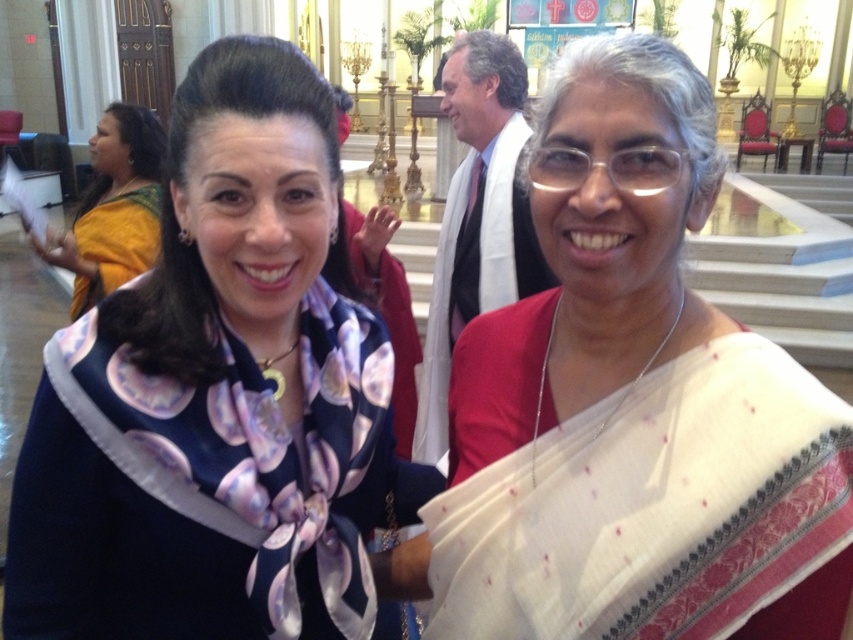
Question: Which object appears farthest from the camera in this image?

Choices:
 (A) silky floral scarf at center
 (B) white silk saree at center
 (C) yellow silk saree at left

Answer: (C)

Question: Which object is positioned farthest from the white silk saree at center?

Choices:
 (A) silky floral scarf at center
 (B) yellow silk saree at left

Answer: (B)

Question: Does silky floral scarf at center lie behind yellow silk saree at left?

Choices:
 (A) yes
 (B) no

Answer: (B)

Question: Can you confirm if silky floral scarf at center is thinner than white silk saree at center?

Choices:
 (A) no
 (B) yes

Answer: (A)

Question: Does silky floral scarf at center have a larger size compared to white silk saree at center?

Choices:
 (A) no
 (B) yes

Answer: (B)

Question: Which object is farther from the camera taking this photo?

Choices:
 (A) yellow silk saree at left
 (B) white silk saree at center
 (C) silky floral scarf at center

Answer: (A)